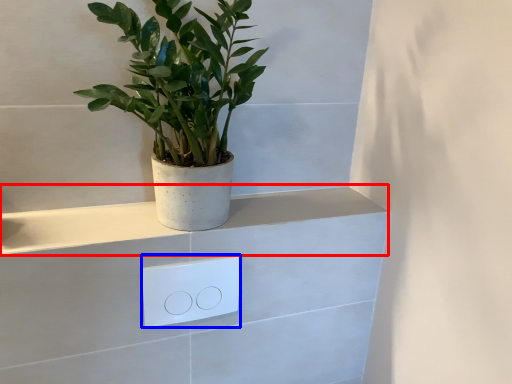
Question: Which object appears farthest to the camera in this image, ledge (highlighted by a red box) or light switch (highlighted by a blue box)?

Choices:
 (A) ledge
 (B) light switch

Answer: (B)